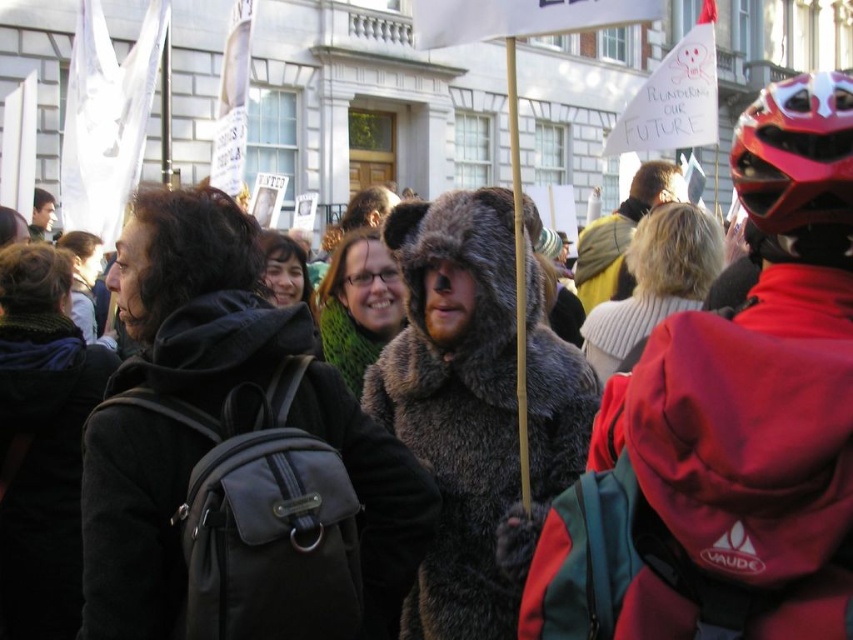
Looking at this image, which is more to the left, dark gray hoodie at center or knitted white sweater at center?

From the viewer's perspective, dark gray hoodie at center appears more on the left side.

Which of these two, dark gray hoodie at center or knitted white sweater at center, stands taller?

With more height is dark gray hoodie at center.

This screenshot has height=640, width=853. Identify the location of dark gray hoodie at center. (234, 456).

Is point (851, 156) closer to camera compared to point (381, 262)?

Yes.

Can you confirm if shiny red helmet at upper right is thinner than green fuzzy scarf at center?

In fact, shiny red helmet at upper right might be wider than green fuzzy scarf at center.

Is point (804, 241) closer to viewer compared to point (352, 308)?

Yes, point (804, 241) is closer to viewer.

At what (x,y) coordinates should I click in order to perform the action: click on shiny red helmet at upper right. Please return your answer as a coordinate pair (x, y). The image size is (853, 640). Looking at the image, I should click on (798, 166).

The image size is (853, 640). Identify the location of dark gray hoodie at center. (234, 456).

From the picture: Measure the distance between dark gray hoodie at center and shiny red helmet at upper right.

dark gray hoodie at center and shiny red helmet at upper right are 24.51 meters apart.

Does point (416, 476) come behind point (846, 248)?

That is True.

Locate an element on the screen. This screenshot has height=640, width=853. dark gray hoodie at center is located at coordinates (234, 456).